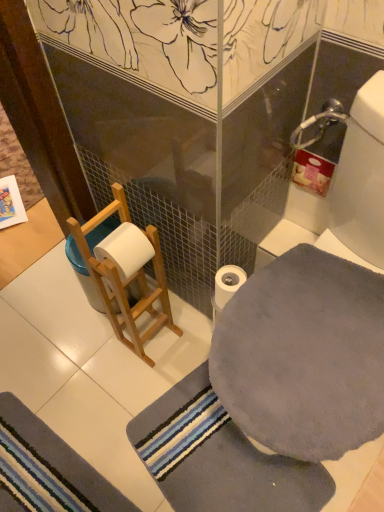
You are a GUI agent. You are given a task and a screenshot of the screen. Output one action in this format:
    pyautogui.click(x=<x>, y=<y>)
    Task: Click on the vacant point above gray plush bath mat at lower left (from a real-world perspective)
    
    Given the screenshot: What is the action you would take?
    pyautogui.click(x=39, y=467)